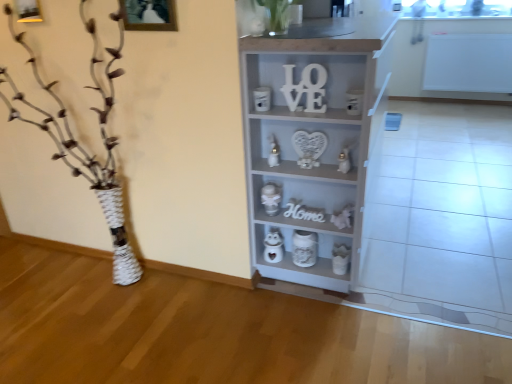
Question: From a real-world perspective, is white glossy candle at center, arranged as the 1th toy when viewed from the top, on top of white glossy owl at lower center, which is counted as the first toy, starting from the bottom?

Choices:
 (A) no
 (B) yes

Answer: (B)

Question: Does white glossy candle at center, arranged as the 1th toy when viewed from the top, appear on the right side of white glossy owl at lower center, which ranks as the 6th toy in top-to-bottom order?

Choices:
 (A) yes
 (B) no

Answer: (B)

Question: Would you say white glossy candle at center, which is the sixth toy from bottom to top, contains white glossy owl at lower center, which is counted as the first toy, starting from the bottom?

Choices:
 (A) yes
 (B) no

Answer: (B)

Question: From a real-world perspective, is white glossy candle at center, which is the sixth toy from bottom to top, below white glossy owl at lower center, which is counted as the first toy, starting from the bottom?

Choices:
 (A) no
 (B) yes

Answer: (A)

Question: Is there a large distance between white glossy candle at center, which is the sixth toy from bottom to top, and white glossy owl at lower center, which is counted as the first toy, starting from the bottom?

Choices:
 (A) no
 (B) yes

Answer: (A)

Question: From the image's perspective, is white glossy candle at center, which is the sixth toy from bottom to top, located above white glossy owl at lower center, which is counted as the first toy, starting from the bottom?

Choices:
 (A) yes
 (B) no

Answer: (A)

Question: Considering the relative positions of white glossy heart at center, which appears as the fifth toy when viewed from the top, and white textured vase at left in the image provided, is white glossy heart at center, which appears as the fifth toy when viewed from the top, to the right of white textured vase at left from the viewer's perspective?

Choices:
 (A) yes
 (B) no

Answer: (A)

Question: From a real-world perspective, is white glossy heart at center, which appears as the fifth toy when viewed from the top, on white textured vase at left?

Choices:
 (A) yes
 (B) no

Answer: (B)

Question: Is there a large distance between white glossy heart at center, which appears as the fifth toy when viewed from the top, and white textured vase at left?

Choices:
 (A) no
 (B) yes

Answer: (A)

Question: From the image's perspective, is white glossy heart at center, which appears as the fifth toy when viewed from the top, beneath white textured vase at left?

Choices:
 (A) no
 (B) yes

Answer: (B)

Question: Considering the relative sizes of white glossy heart at center, the second toy from the bottom, and white textured vase at left in the image provided, is white glossy heart at center, the second toy from the bottom, smaller than white textured vase at left?

Choices:
 (A) yes
 (B) no

Answer: (A)

Question: Is white glossy heart at center, the second toy from the bottom, outside of white textured vase at left?

Choices:
 (A) yes
 (B) no

Answer: (A)

Question: Does green matte plant at upper center have a lesser height compared to metallic silver toy at center, the third toy viewed from the top?

Choices:
 (A) no
 (B) yes

Answer: (B)